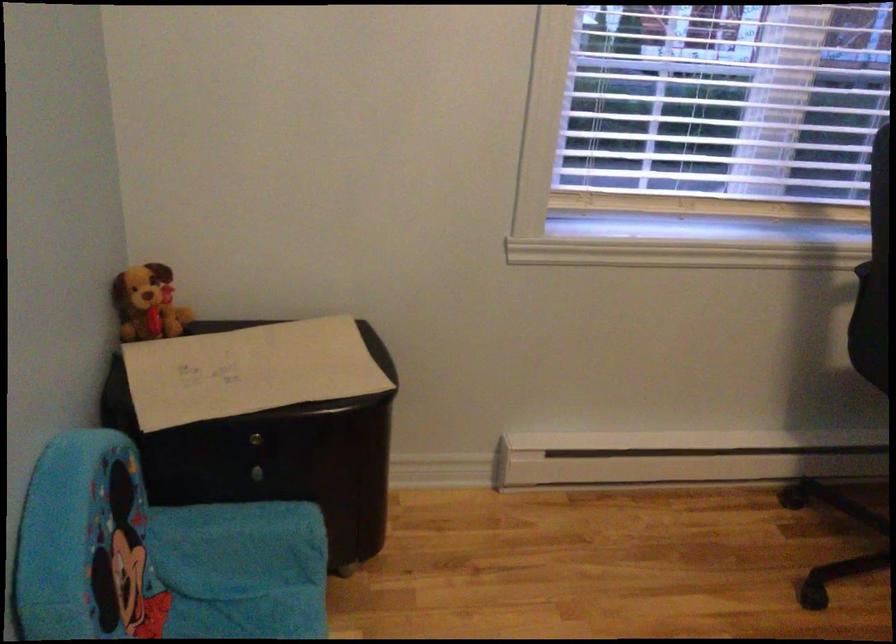
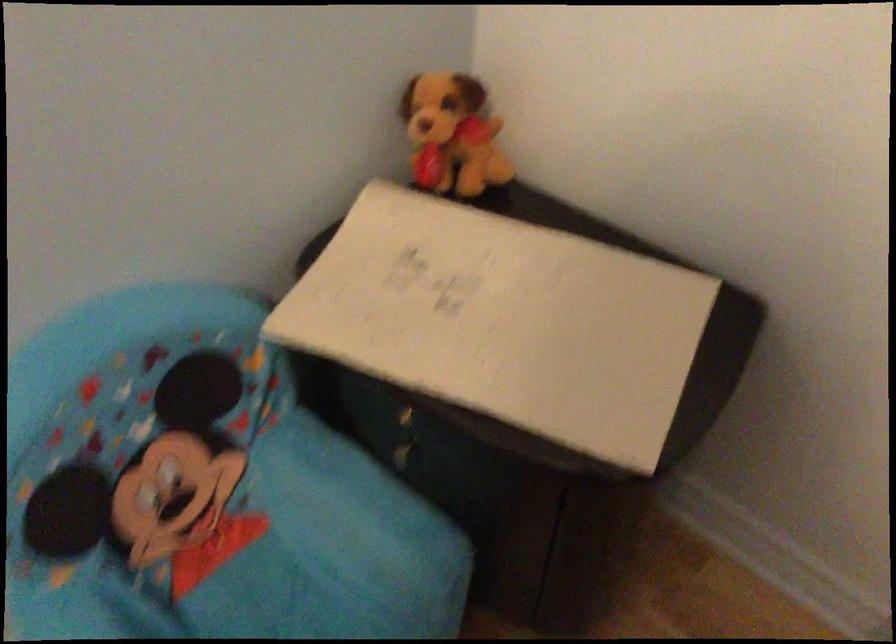
Where in the second image is the point corresponding to point 255,465 from the first image?

(403, 438)